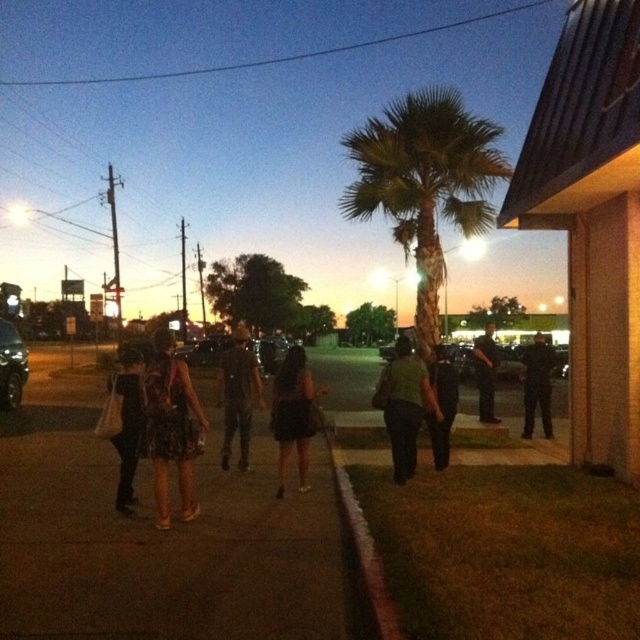
Question: Among these points, which one is nearest to the camera?

Choices:
 (A) (394, 476)
 (B) (445, 417)
 (C) (288, 387)
 (D) (548, 435)

Answer: (C)

Question: In this image, where is dark asphalt sidewalk at center located relative to dark green fabric pants at center?

Choices:
 (A) right
 (B) left

Answer: (B)

Question: Does green leafy palm tree at center appear over black matte dress at center?

Choices:
 (A) no
 (B) yes

Answer: (B)

Question: Which point is closer to the camera taking this photo?

Choices:
 (A) (243, 358)
 (B) (493, 410)

Answer: (A)

Question: Is black floral dress at center to the left of black uniform at center from the viewer's perspective?

Choices:
 (A) no
 (B) yes

Answer: (B)

Question: Which object is positioned farthest from the black matte dress at center?

Choices:
 (A) dark brown leather jacket at center
 (B) concrete at lower center

Answer: (A)